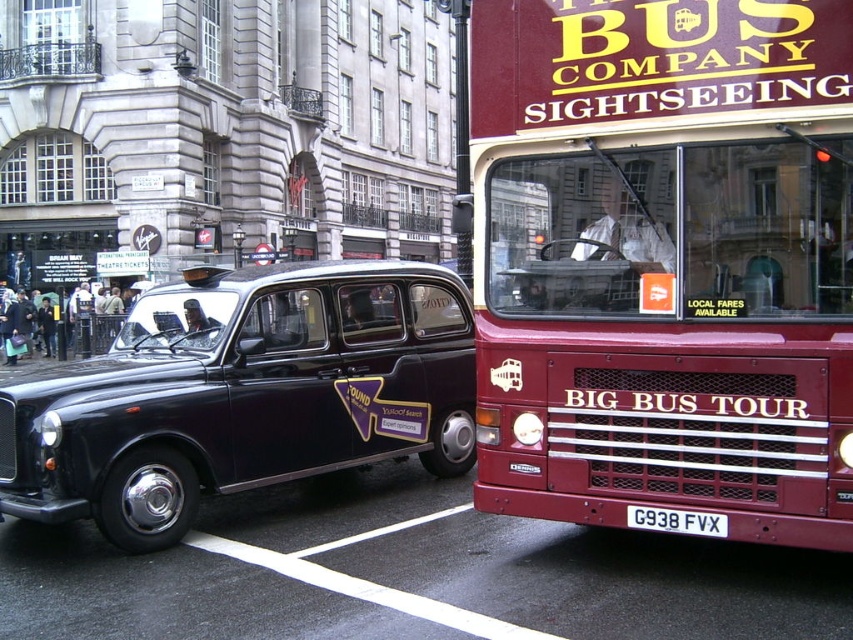
Question: Among these objects, which one is farthest from the camera?

Choices:
 (A) white plastic license plate at center
 (B) dark purple leather car at left

Answer: (B)

Question: Observing the image, what is the correct spatial positioning of maroon metallic bus at center in reference to shiny black taxi at center?

Choices:
 (A) below
 (B) above

Answer: (B)

Question: Which point is closer to the camera?

Choices:
 (A) (180, 467)
 (B) (802, 172)
 (C) (722, 524)
 (D) (112, 321)

Answer: (B)

Question: Is shiny black taxi at center thinner than white plastic license plate at center?

Choices:
 (A) no
 (B) yes

Answer: (B)

Question: In this image, where is dark purple leather car at left located relative to white plastic license plate at center?

Choices:
 (A) below
 (B) above

Answer: (B)

Question: Which point is farther from the camera taking this photo?

Choices:
 (A) (643, 515)
 (B) (363, 317)

Answer: (B)